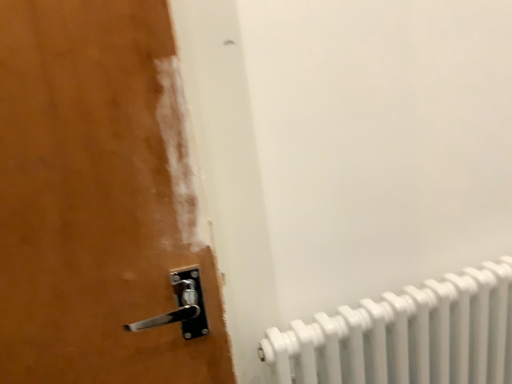
Based on the photo, measure the distance between white glossy radiator at right and camera.

Result: white glossy radiator at right and camera are 29.62 inches apart from each other.

What is the approximate width of white glossy radiator at right?

It is 4.18 inches.

What do you see at coordinates (407, 335) in the screenshot? I see `white glossy radiator at right` at bounding box center [407, 335].

At what (x,y) coordinates should I click in order to perform the action: click on white glossy radiator at right. Please return your answer as a coordinate pair (x, y). This screenshot has height=384, width=512. Looking at the image, I should click on (407, 335).

Identify the location of white glossy radiator at right. (407, 335).